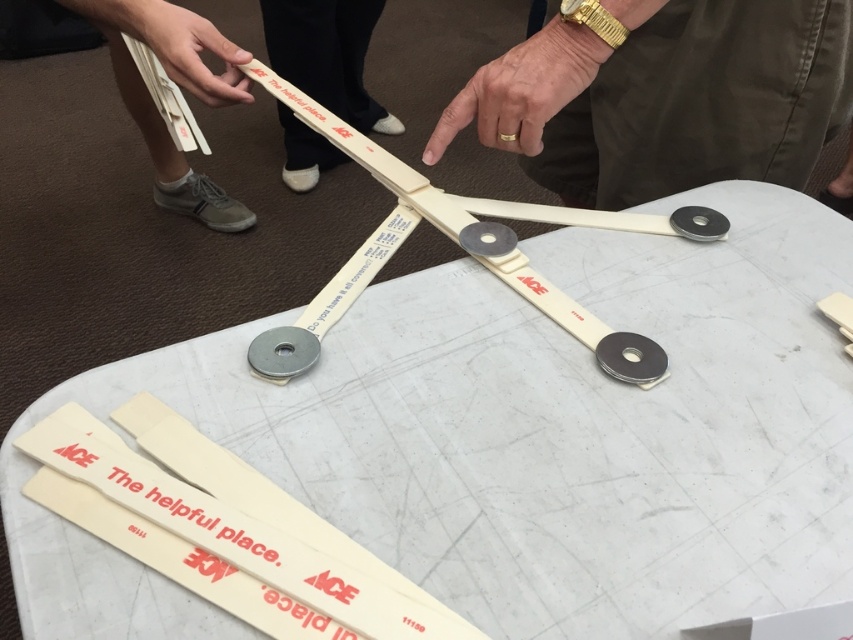
Question: Can you confirm if gold metallic ring at upper center is positioned to the right of matte white hand at upper left?

Choices:
 (A) no
 (B) yes

Answer: (B)

Question: Observing the image, what is the correct spatial positioning of white plastic table at center in reference to gold metallic watch at upper center?

Choices:
 (A) left
 (B) right

Answer: (A)

Question: Which point is closer to the camera?

Choices:
 (A) tap(129, 32)
 (B) tap(704, 3)
 (C) tap(337, 60)
 (D) tap(468, 120)

Answer: (D)

Question: Can you confirm if gold metallic watch at upper center is positioned below gold metallic ring at upper center?

Choices:
 (A) yes
 (B) no

Answer: (B)

Question: Among these points, which one is farthest from the camera?

Choices:
 (A) (148, 13)
 (B) (531, 128)
 (C) (314, 179)

Answer: (C)

Question: Which point is closer to the camera?

Choices:
 (A) (207, 26)
 (B) (349, 3)
 (C) (766, 108)

Answer: (C)